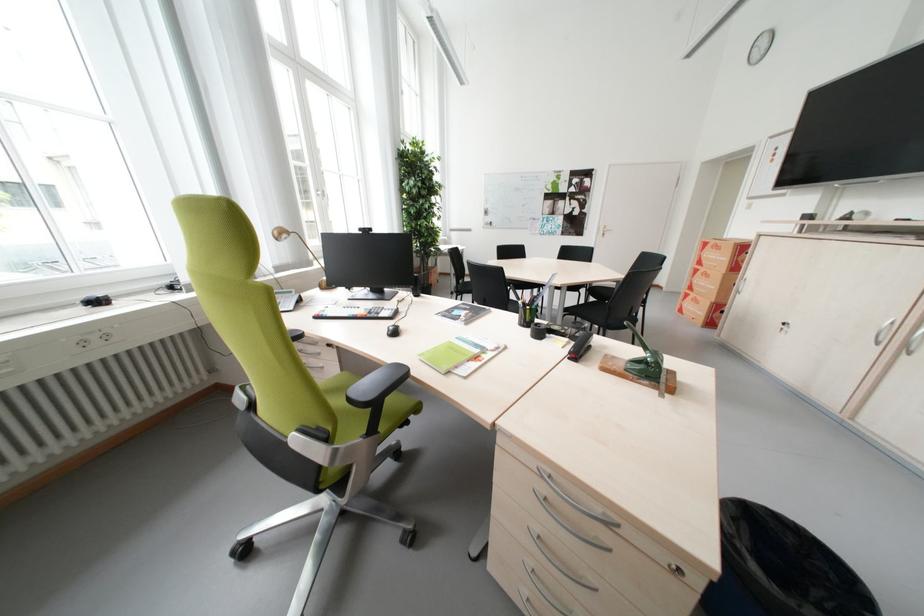
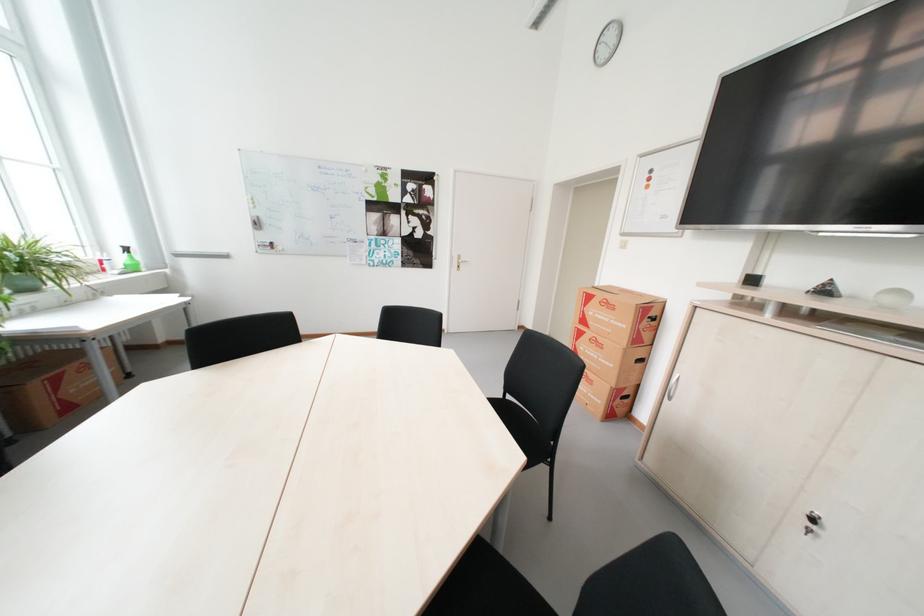
In the second image, find the point that corresponds to (x=706, y=272) in the first image.

(590, 334)